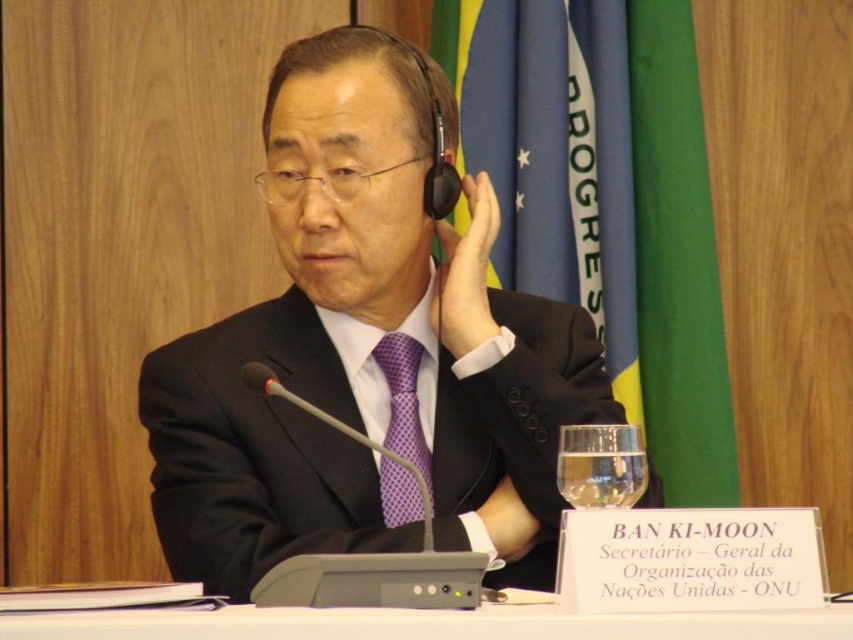
Consider the image. You are organizing a formal event and need to ensure proper seating arrangements. The black matte suit at center and the white plastic table at center are part of the setup. Based on their positions, which object is located to the left of the other?

The black matte suit at center is positioned on the left side of white plastic table at center.

You are a photographer at a formal event. You need to capture a clear shot of the black matte suit at center and the white plastic table at center. Which object is positioned higher in the image?

The black matte suit at center is above the white plastic table at center, so it is positioned higher in the image.

You are a fashion designer observing a man in formal attire at a meeting. You notice the black matte suit at center and the purple dotted tie at center. Which clothing item is positioned more to the left?

The black matte suit at center is positioned on the left side of purple dotted tie at center, so the black matte suit at center is more to the left.